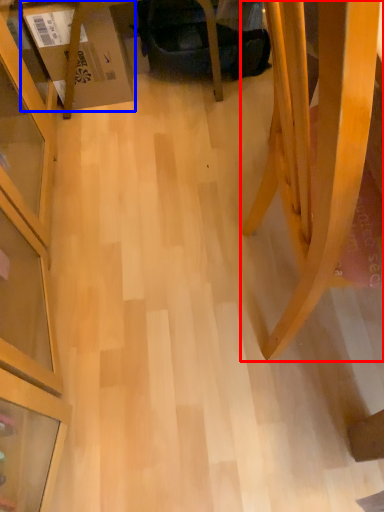
Question: Which of the following is the farthest to the observer, furniture (highlighted by a red box) or cardboard box (highlighted by a blue box)?

Choices:
 (A) furniture
 (B) cardboard box

Answer: (B)